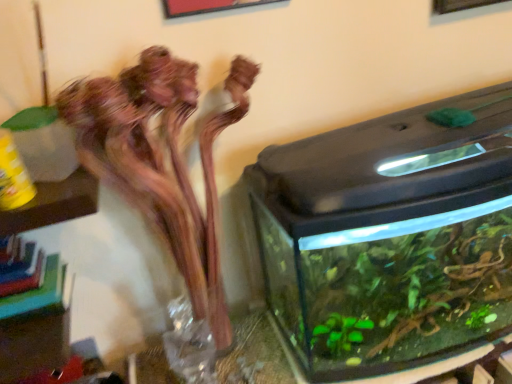
Locate an element on the screen. This screenshot has width=512, height=384. translucent glass vase at center is located at coordinates (392, 287).

You are a GUI agent. You are given a task and a screenshot of the screen. Output one action in this format:
    pyautogui.click(x=<x>, y=<y>)
    Task: Click on the translucent glass vase at center
    
    Given the screenshot: What is the action you would take?
    pyautogui.click(x=392, y=287)

Is the depth of translucent glass vase at center less than that of translucent glass vase at left?

No, translucent glass vase at center is further to the viewer.

Is translucent glass vase at center in contact with translucent glass vase at left?

No, translucent glass vase at center is not with translucent glass vase at left.

Is translucent glass vase at center oriented towards translucent glass vase at left?

No, translucent glass vase at center is not aimed at translucent glass vase at left.

Looking at the image, does translucent glass vase at center seem bigger or smaller compared to translucent glass vase at left?

Clearly, translucent glass vase at center is larger in size than translucent glass vase at left.

Is transparent glass water tank at right far away from translucent glass vase at left?

transparent glass water tank at right is actually quite close to translucent glass vase at left.

From the image's perspective, is transparent glass water tank at right beneath translucent glass vase at left?

No, from the image's perspective, transparent glass water tank at right is not beneath translucent glass vase at left.

In the scene shown: Which object is wider, transparent glass water tank at right or translucent glass vase at left?

transparent glass water tank at right is wider.

Can you confirm if translucent glass vase at center is bigger than transparent glass vase at center?

Indeed, translucent glass vase at center has a larger size compared to transparent glass vase at center.

From a real-world perspective, is translucent glass vase at center physically below transparent glass vase at center?

Yes, from a real-world perspective, translucent glass vase at center is beneath transparent glass vase at center.

Identify the location of glass vase behind the translucent glass vase at center. (189, 345).

Which point is more forward, (x=361, y=247) or (x=185, y=308)?

Positioned in front is point (x=361, y=247).

From the image's perspective, is translucent glass vase at left under transparent glass vase at center?

No, from the image's perspective, translucent glass vase at left is not beneath transparent glass vase at center.

Is translucent glass vase at left taller or shorter than transparent glass vase at center?

Considering their sizes, translucent glass vase at left has more height than transparent glass vase at center.

How many degrees apart are the facing directions of translucent glass vase at left and transparent glass vase at center?

0.572 degrees.

Could you tell me if translucent glass vase at left is facing transparent glass vase at center?

Yes, translucent glass vase at left is oriented towards transparent glass vase at center.

What's the angular difference between translucent glass vase at left and translucent glass vase at center's facing directions?

The facing directions of translucent glass vase at left and translucent glass vase at center are 2.43 degrees apart.

Looking at this image, can you confirm if translucent glass vase at left is taller than translucent glass vase at center?

Yes.

Considering the sizes of objects translucent glass vase at left and translucent glass vase at center in the image provided, who is bigger, translucent glass vase at left or translucent glass vase at center?

Bigger between the two is translucent glass vase at center.

Is translucent glass vase at left inside the boundaries of translucent glass vase at center, or outside?

translucent glass vase at left is located beyond the bounds of translucent glass vase at center.

The width and height of the screenshot is (512, 384). In order to click on plant on the right of transparent glass vase at center in this screenshot , I will do `click(392, 287)`.

Which is nearer, (192, 324) or (438, 316)?

Point (192, 324) is farther from the camera than point (438, 316).

Between transparent glass vase at center and translucent glass vase at center, which one has more height?

translucent glass vase at center.

Which object is closer to the camera taking this photo, transparent glass vase at center or translucent glass vase at center?

translucent glass vase at center is in front.

Find the location of `water tank on the right of translucent glass vase at center`. water tank on the right of translucent glass vase at center is located at coordinates coord(389,238).

From a real-world perspective, which is physically above, transparent glass water tank at right or translucent glass vase at center?

transparent glass water tank at right is physically above.

In the scene shown: Is transparent glass water tank at right positioned in front of translucent glass vase at center?

Yes, transparent glass water tank at right is in front of translucent glass vase at center.

Find the location of a particular element. Image resolution: width=512 pixels, height=384 pixels. plant that appears on the right of translucent glass vase at left is located at coordinates (392, 287).

The width and height of the screenshot is (512, 384). In order to click on houseplant located below the transparent glass water tank at right (from the image's perspective) in this screenshot , I will do `click(161, 160)`.

Based on their spatial positions, is transparent glass vase at center or translucent glass vase at left closer to transparent glass water tank at right?

translucent glass vase at left is positioned closer to the anchor transparent glass water tank at right.

Based on their spatial positions, is translucent glass vase at left or transparent glass vase at center closer to transparent glass water tank at right?

The object closer to transparent glass water tank at right is translucent glass vase at left.

Considering their positions, is translucent glass vase at center positioned further to transparent glass water tank at right than transparent glass vase at center?

Based on the image, transparent glass vase at center appears to be further to transparent glass water tank at right.

Estimate the real-world distances between objects in this image. Which object is further from transparent glass water tank at right, translucent glass vase at center or translucent glass vase at left?

translucent glass vase at left lies further to transparent glass water tank at right than the other object.

From the image, which object appears to be farther from translucent glass vase at center, transparent glass water tank at right or translucent glass vase at left?

translucent glass vase at left is further to translucent glass vase at center.

Considering their positions, is transparent glass water tank at right positioned closer to translucent glass vase at left than transparent glass vase at center?

Based on the image, transparent glass vase at center appears to be nearer to translucent glass vase at left.

Based on their spatial positions, is translucent glass vase at left or translucent glass vase at center further from transparent glass vase at center?

translucent glass vase at center lies further to transparent glass vase at center than the other object.

Considering their positions, is translucent glass vase at left positioned further to transparent glass water tank at right than translucent glass vase at center?

translucent glass vase at left lies further to transparent glass water tank at right than the other object.

Where is `houseplant between transparent glass vase at center and transparent glass water tank at right in the horizontal direction`? houseplant between transparent glass vase at center and transparent glass water tank at right in the horizontal direction is located at coordinates (161, 160).

You are a GUI agent. You are given a task and a screenshot of the screen. Output one action in this format:
    pyautogui.click(x=<x>, y=<y>)
    Task: Click on the houseplant between transparent glass vase at center and translucent glass vase at center in the horizontal direction
    
    Given the screenshot: What is the action you would take?
    pyautogui.click(x=161, y=160)

You are a GUI agent. You are given a task and a screenshot of the screen. Output one action in this format:
    pyautogui.click(x=<x>, y=<y>)
    Task: Click on the plant between translucent glass vase at left and transparent glass water tank at right from left to right
    The height and width of the screenshot is (384, 512).
    Given the screenshot: What is the action you would take?
    pyautogui.click(x=392, y=287)

Where is `plant situated between transparent glass vase at center and transparent glass water tank at right from left to right`? plant situated between transparent glass vase at center and transparent glass water tank at right from left to right is located at coordinates (392, 287).